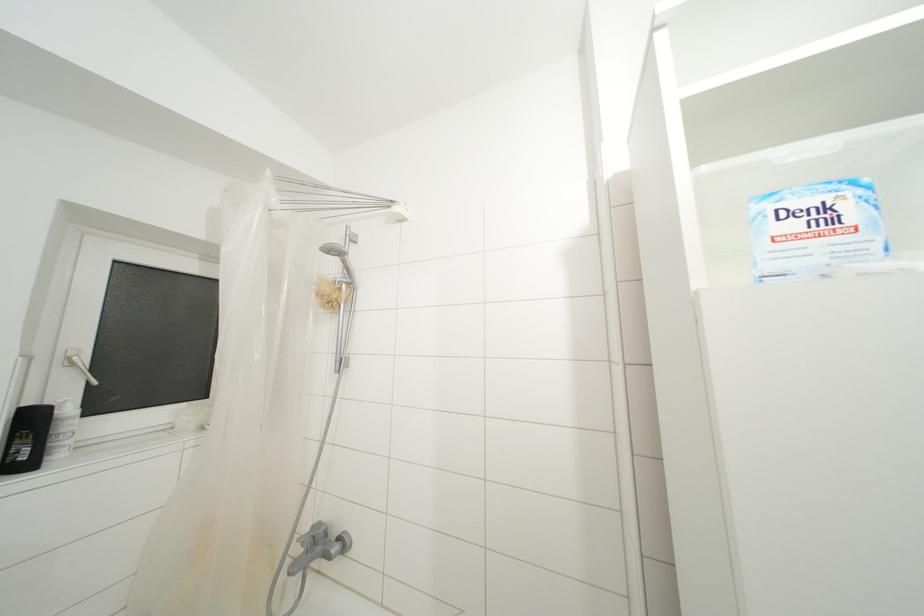
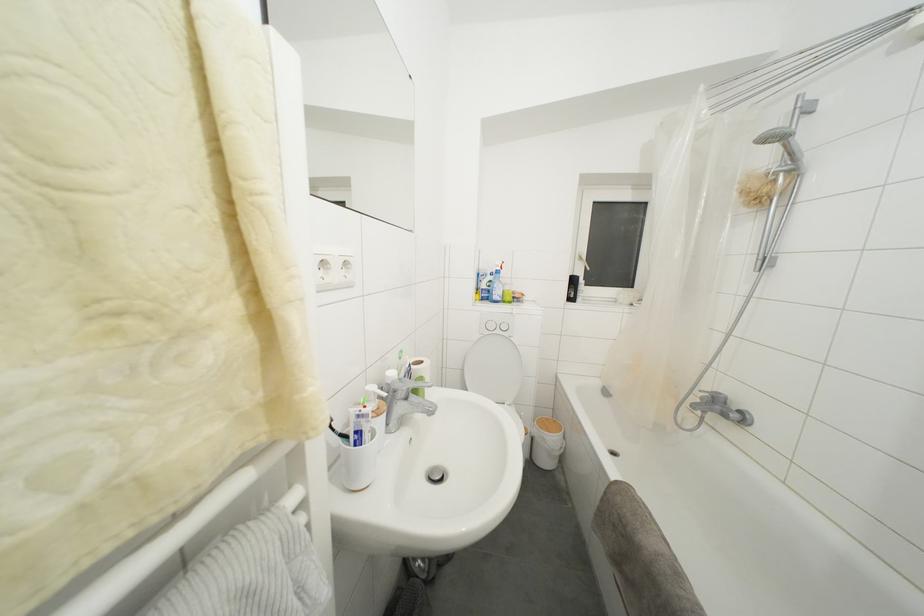
Question: The camera is either moving clockwise (left) or counter-clockwise (right) around the object. The first image is from the beginning of the video and the second image is from the end. Is the camera moving left or right when shooting the video?

Choices:
 (A) Left
 (B) Right

Answer: (B)